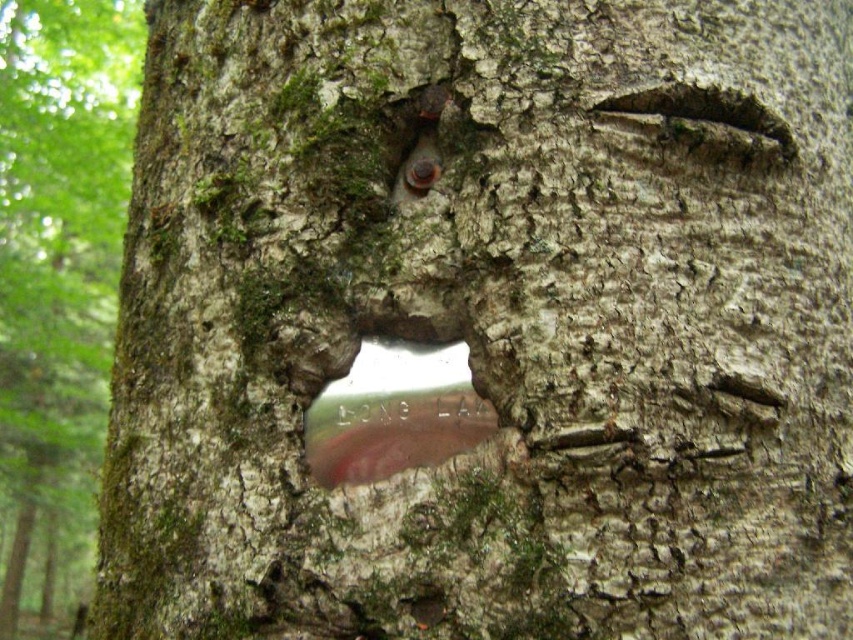
Question: Which point is closer to the camera taking this photo?

Choices:
 (A) (439, 378)
 (B) (19, 396)

Answer: (A)

Question: Observing the image, what is the correct spatial positioning of green mossy bark at left in reference to transparent plastic hole at center?

Choices:
 (A) above
 (B) below

Answer: (A)

Question: Does green mossy bark at left have a greater width compared to transparent plastic hole at center?

Choices:
 (A) yes
 (B) no

Answer: (A)

Question: Is green mossy bark at left further to the viewer compared to transparent plastic hole at center?

Choices:
 (A) yes
 (B) no

Answer: (A)